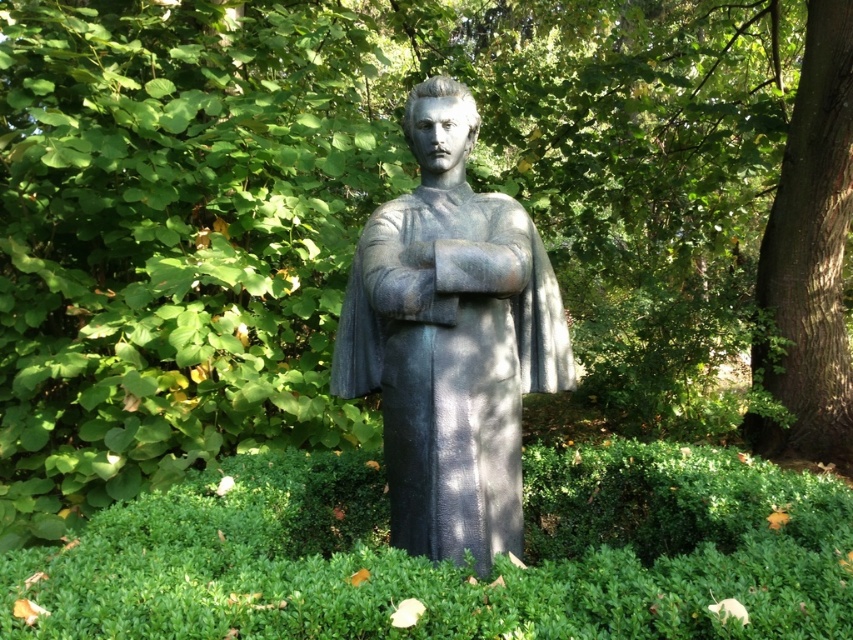
You are a landscape architect designing a new garden layout. You need to place a new decorative fountain that requires a base higher than the gray stone statue at center. Can the smooth brown bark at right provide a suitable base for the fountain?

The gray stone statue at center has a lesser height compared to smooth brown bark at right, so the smooth brown bark at right is taller and can provide a suitable base for the fountain.

You are a gardener planning to water the plants around the gray stone statue at center and the smooth brown bark at right. Which object should you approach first if you want to water the nearest one first?

The gray stone statue at center is closer to the viewer than the smooth brown bark at right, so you should approach the gray stone statue at center first.

In the scene shown: You are a landscape architect designing a new garden. You have to place a new bench that requires a space larger than the gray stone statue at center. Can the smooth brown bark at right provide enough space for the bench?

The gray stone statue at center is smaller than the smooth brown bark at right, so the smooth brown bark at right has enough space to accommodate the bench.